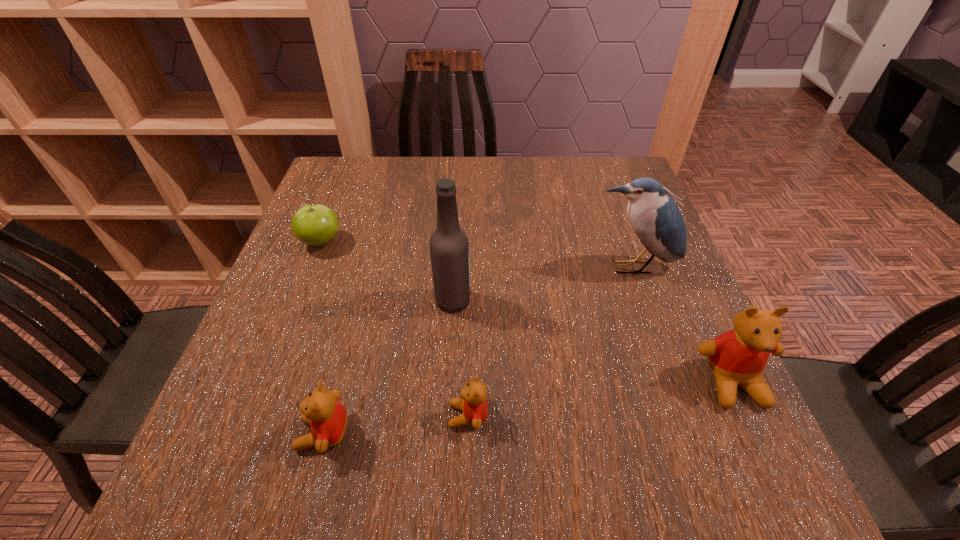
The width and height of the screenshot is (960, 540). Find the location of `the leftmost teddy bear`. the leftmost teddy bear is located at coordinates (327, 417).

Identify the location of the second object from left to right. (327, 417).

In order to click on the shortest object in this screenshot , I will do `click(473, 404)`.

Locate an element on the screen. the second teddy bear from right to left is located at coordinates (473, 404).

Identify the location of the tallest teddy bear. (738, 357).

The image size is (960, 540). What are the coordinates of `the fourth shortest object` in the screenshot? It's located at (738, 357).

Identify the location of the second tallest object. (654, 216).

Locate an element on the screen. This screenshot has width=960, height=540. beer bottle is located at coordinates (449, 246).

Where is `the tallest object`? the tallest object is located at coordinates (449, 246).

You are a GUI agent. You are given a task and a screenshot of the screen. Output one action in this format:
    pyautogui.click(x=<x>, y=<y>)
    Task: Click on the leftmost object
    
    Given the screenshot: What is the action you would take?
    pyautogui.click(x=316, y=225)